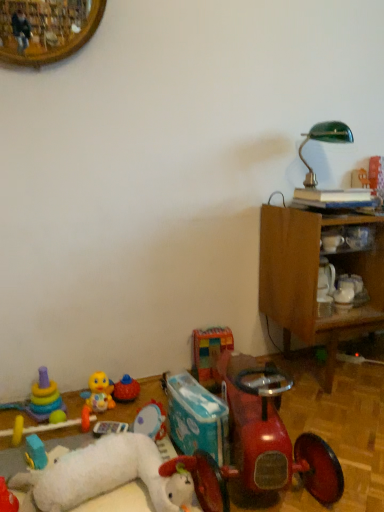
Identify the location of vacant area on the back side of teal rubber toy at lower left, placed as the third toy when sorted from left to right. 62,430.